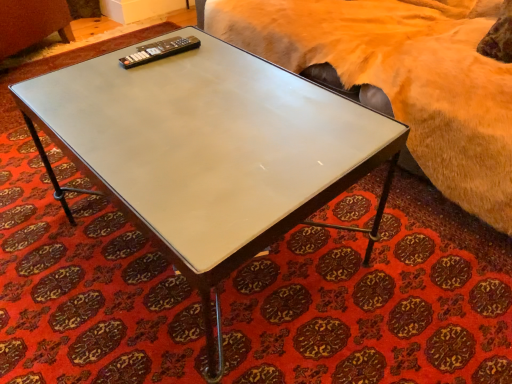
Question: From the image's perspective, relative to white glossy coffee table at center, is black plastic remote at upper left above or below?

Choices:
 (A) above
 (B) below

Answer: (A)

Question: From a real-world perspective, is black plastic remote at upper left above or below white glossy coffee table at center?

Choices:
 (A) below
 (B) above

Answer: (B)

Question: Estimate the real-world distances between objects in this image. Which object is closer to the black plastic remote at upper left?

Choices:
 (A) fuzzy beige bed at upper right
 (B) white glossy coffee table at center

Answer: (B)

Question: Which is nearer to the white glossy coffee table at center?

Choices:
 (A) black plastic remote at upper left
 (B) fuzzy beige bed at upper right

Answer: (A)